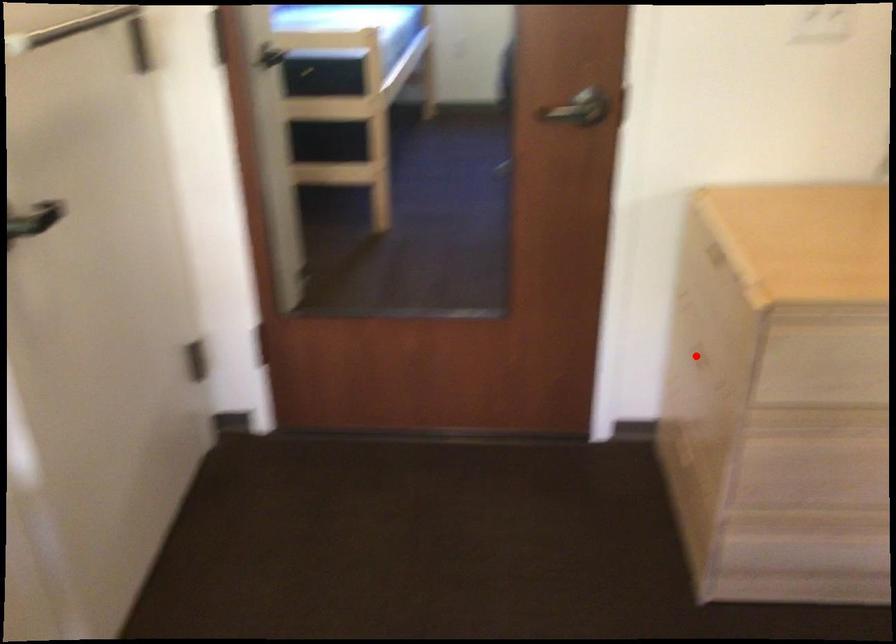
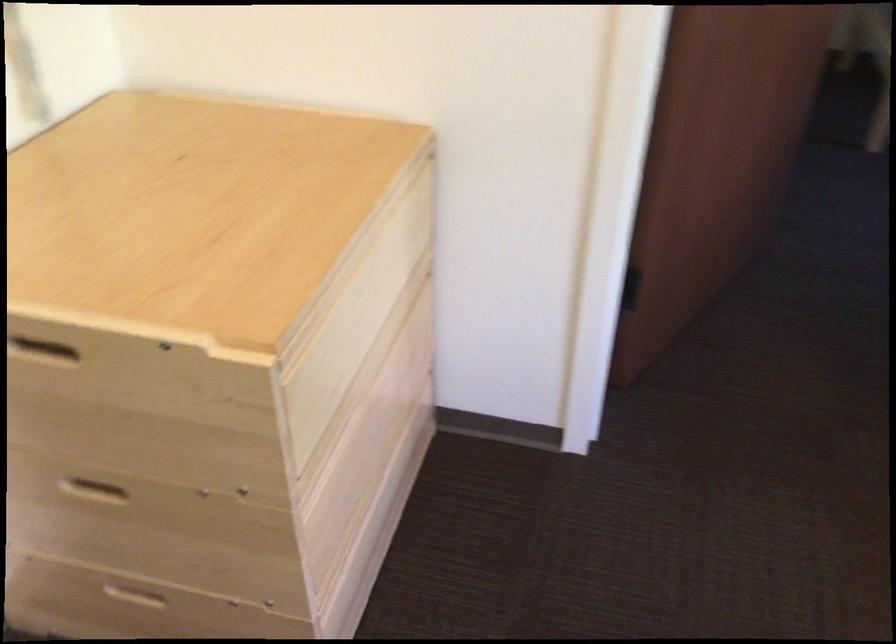
Locate, in the second image, the point that corresponds to the highlighted location in the first image.

(90, 488)